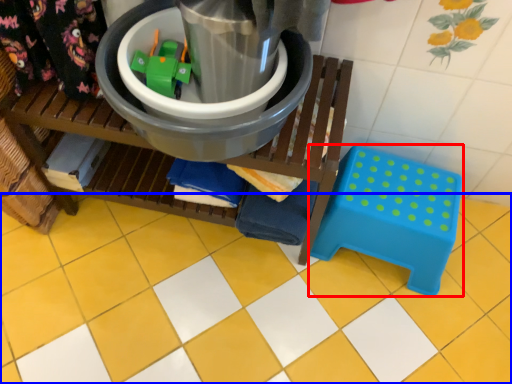
Question: Which object is further to the camera taking this photo, step stool (highlighted by a red box) or ceramic tile (highlighted by a blue box)?

Choices:
 (A) step stool
 (B) ceramic tile

Answer: (A)